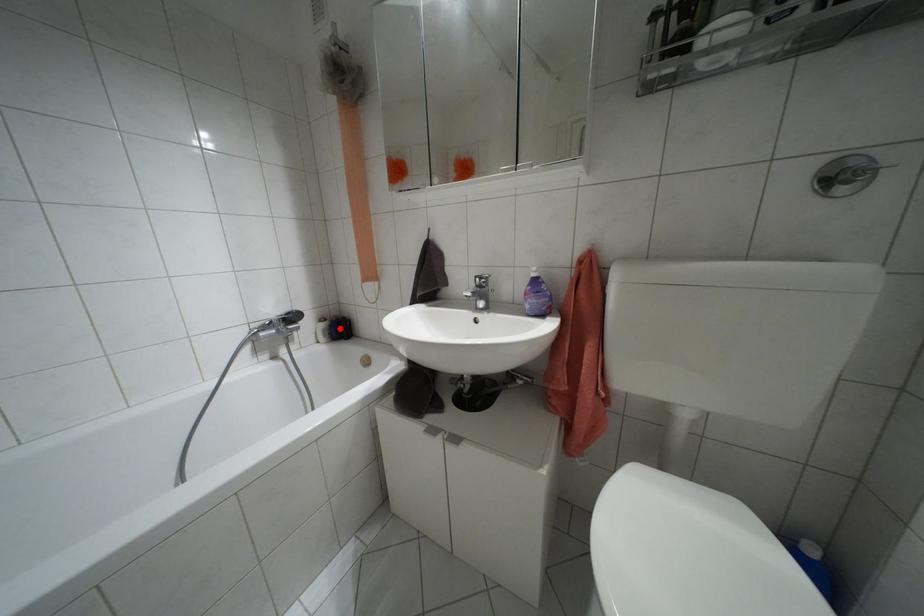
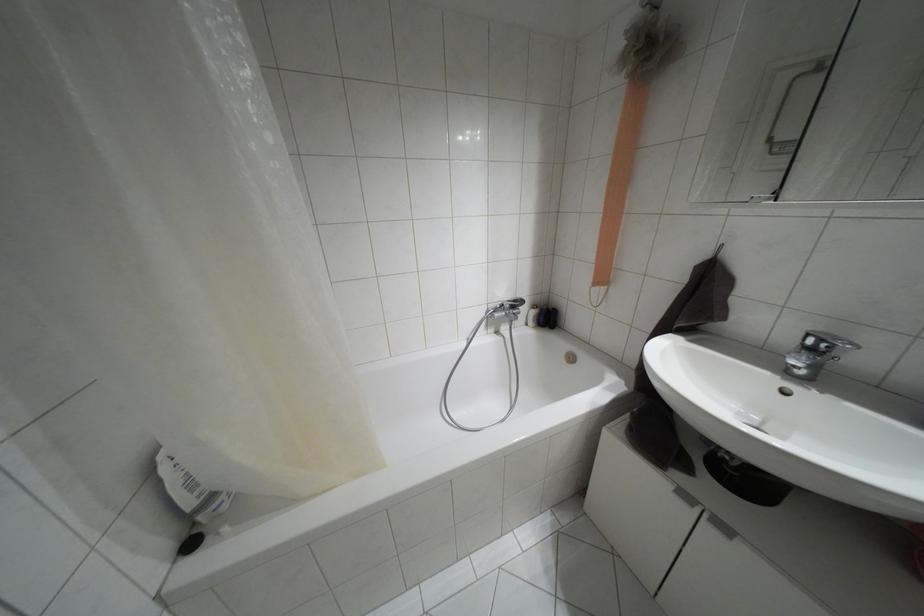
Question: A red point is marked in image1. In image2, is the corresponding 3D point closer to the camera or farther? Reply with the corresponding letter.

Choices:
 (A) The corresponding 3D point is closer.
 (B) The corresponding 3D point is farther.

Answer: (B)